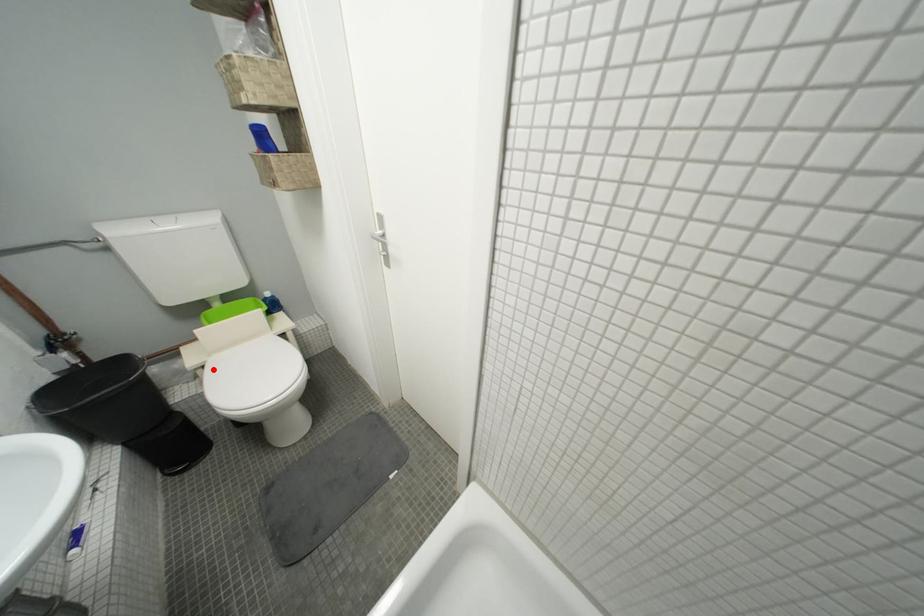
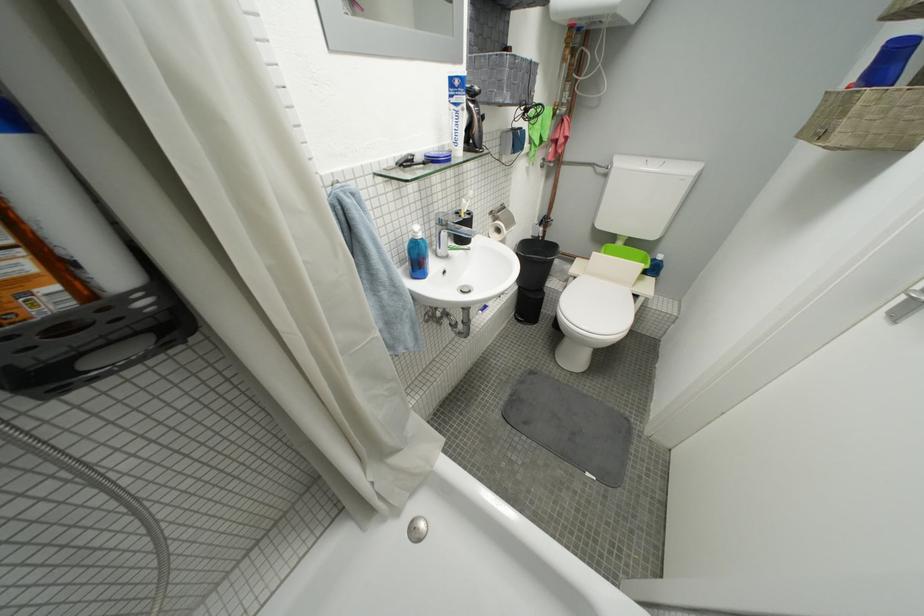
Question: I am providing you with two images of the same scene from different viewpoints. In image1, a red point is highlighted. Considering the same 3D point in image2, which of the following is correct?

Choices:
 (A) It is closer
 (B) It is farther

Answer: (A)